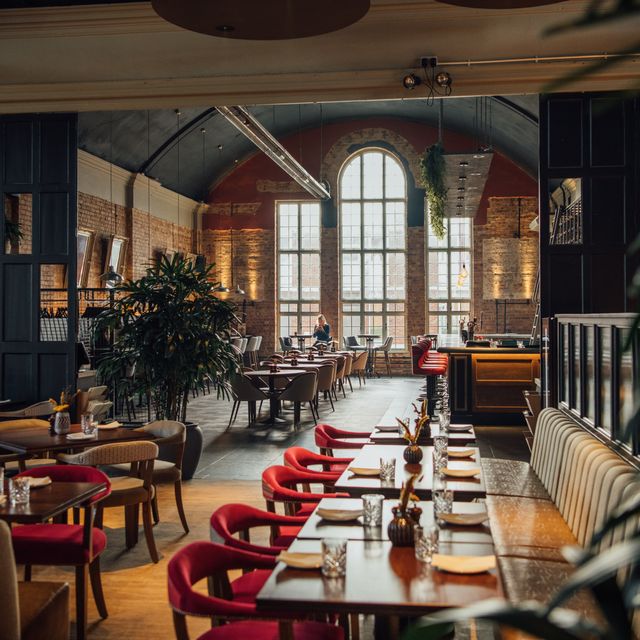
What are the coordinates of `wall hanging` in the screenshot? It's located at (84, 237), (116, 248), (171, 256).